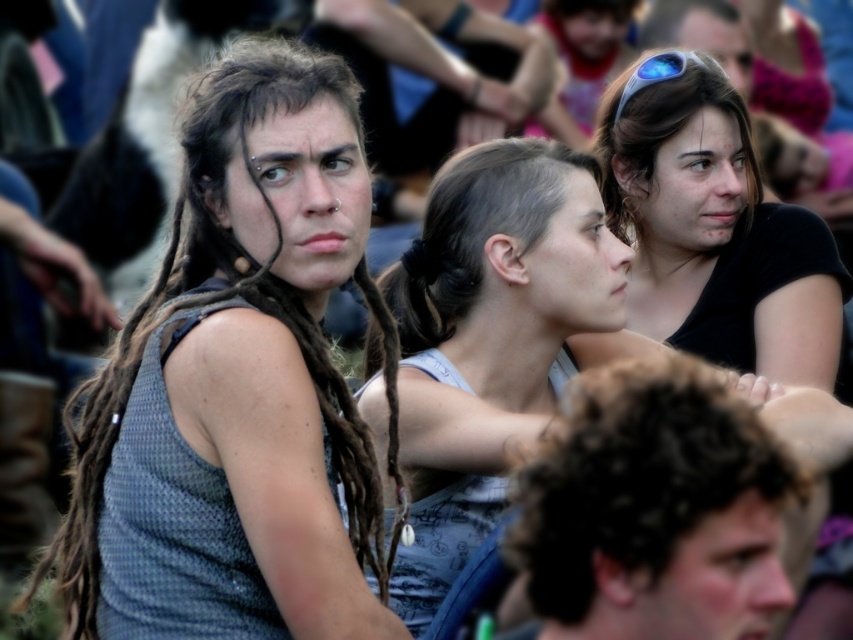
Is matte hair at center bigger than smooth skin face at upper right?

Actually, matte hair at center might be smaller than smooth skin face at upper right.

Who is positioned more to the left, matte hair at center or smooth skin face at upper right?

matte hair at center is more to the left.

Image resolution: width=853 pixels, height=640 pixels. Describe the element at coordinates (312, 192) in the screenshot. I see `matte hair at center` at that location.

Identify the location of matte hair at center. The image size is (853, 640). (312, 192).

Between gray textured tank top at left and smooth skin face at lower right, which one is positioned lower?

smooth skin face at lower right

Who is more forward, (306,160) or (708,634)?

Positioned in front is point (708,634).

Locate an element on the screen. This screenshot has width=853, height=640. gray textured tank top at left is located at coordinates (238, 385).

Which is below, light brown hair at center or smooth skin face at lower right?

Positioned lower is smooth skin face at lower right.

Can you confirm if light brown hair at center is shorter than smooth skin face at lower right?

In fact, light brown hair at center may be taller than smooth skin face at lower right.

At what (x,y) coordinates should I click in order to perform the action: click on light brown hair at center. Please return your answer as a coordinate pair (x, y). The height and width of the screenshot is (640, 853). Looking at the image, I should click on (492, 337).

Locate an element on the screen. light brown hair at center is located at coordinates (492, 337).